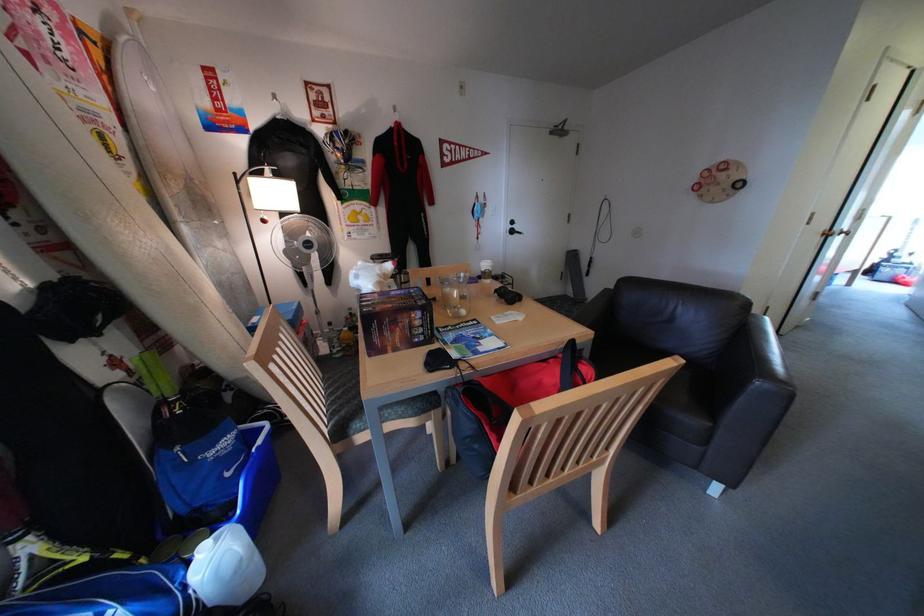
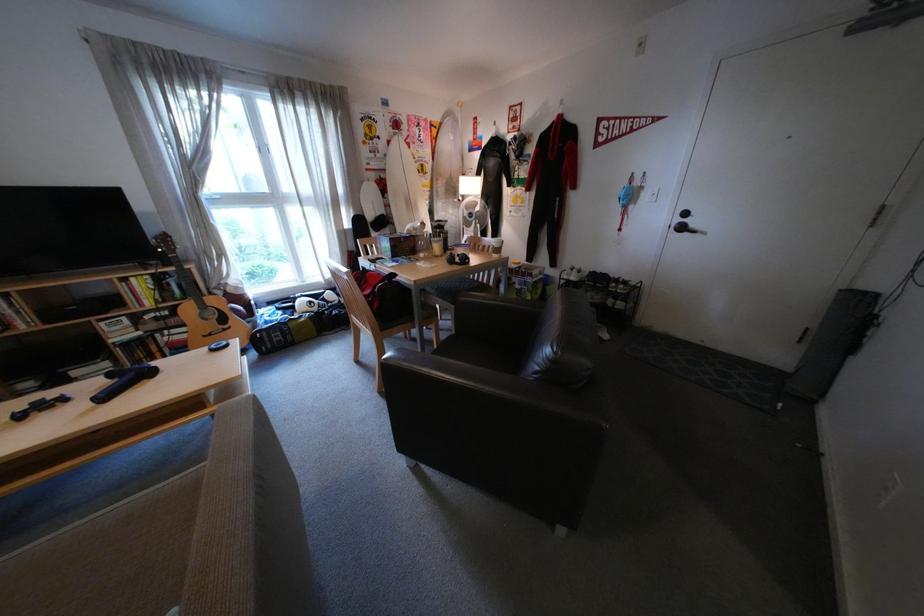
In the second image, find the point that corresponds to the point at 406,272 in the first image.

(433, 228)